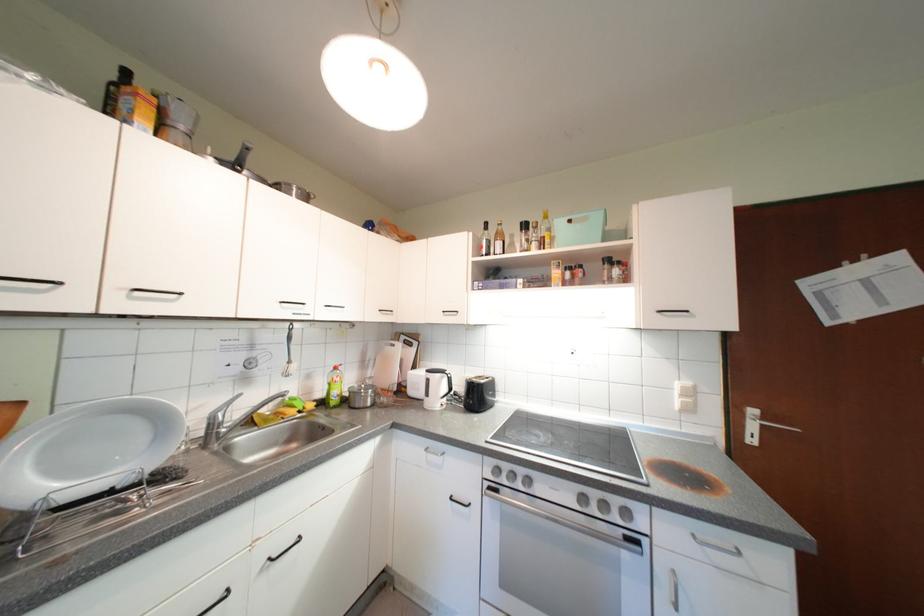
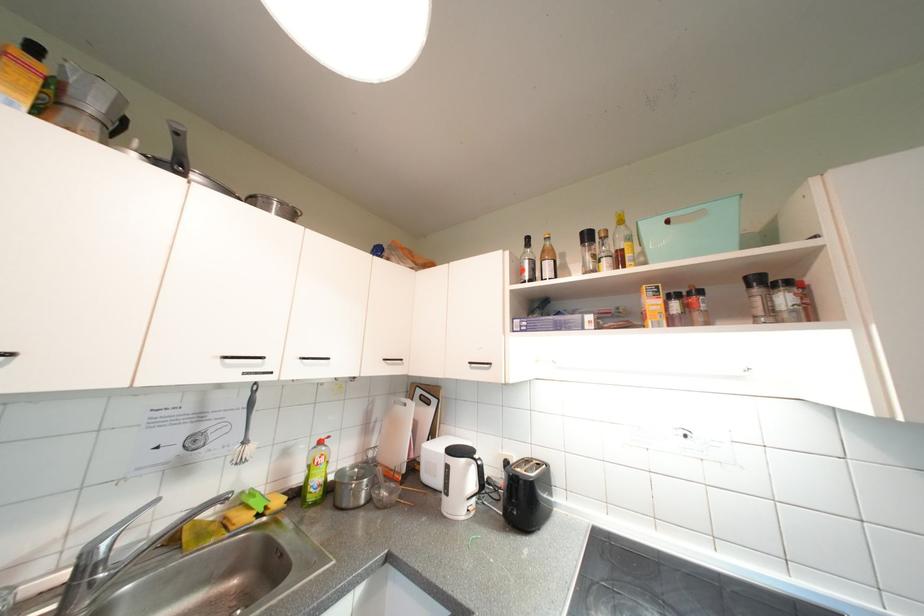
Question: In a continuous first-person perspective shot, in which direction is the camera moving?

Choices:
 (A) Left
 (B) Right
 (C) Forward
 (D) Backward

Answer: (C)